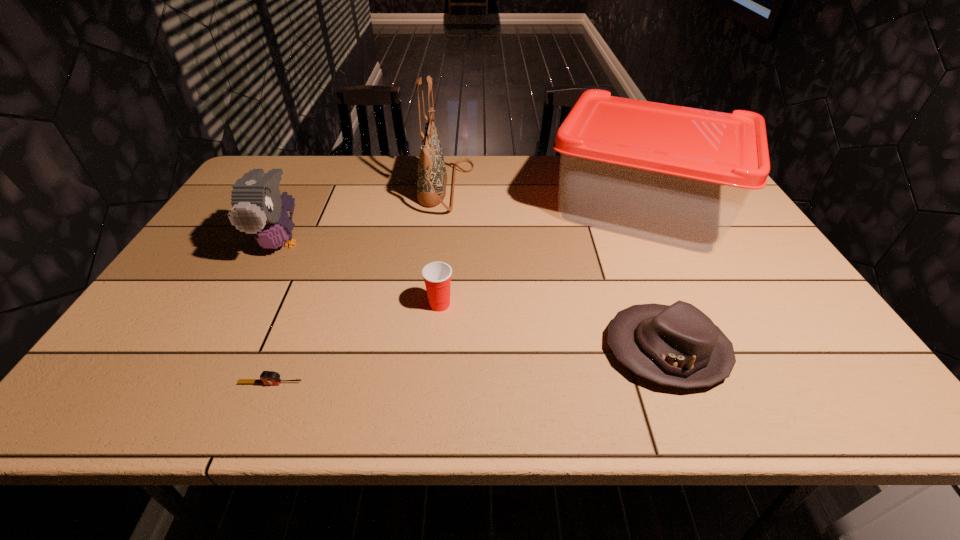
At what (x,y) coordinates should I click in order to perform the action: click on free location that satisfies the following two spatial constraints: 1. at the beak of the leftmost object; 2. on the right side of the fifth object from right to left. Please return your answer as a coordinate pair (x, y). This screenshot has height=540, width=960. Looking at the image, I should click on (207, 383).

Where is `blank space that satisfies the following two spatial constraints: 1. on the front-facing side of the tallest object; 2. on the back side of the tray`? This screenshot has height=540, width=960. blank space that satisfies the following two spatial constraints: 1. on the front-facing side of the tallest object; 2. on the back side of the tray is located at coordinates (444, 208).